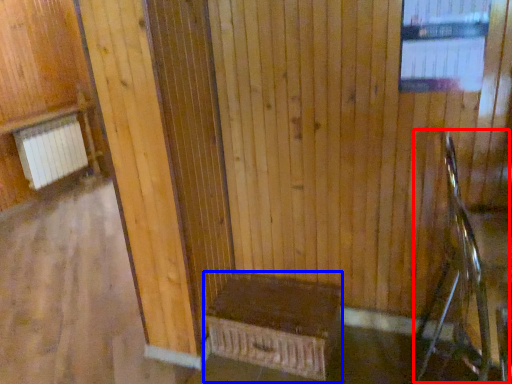
Question: Which point is further to the camera, rocking chair (highlighted by a red box) or furniture (highlighted by a blue box)?

Choices:
 (A) rocking chair
 (B) furniture

Answer: (B)